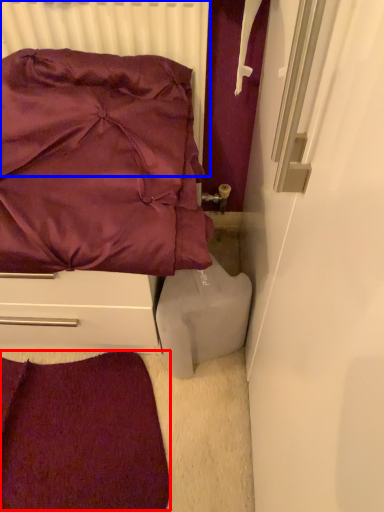
Question: Which point is further to the camera, violet (highlighted by a red box) or radiator (highlighted by a blue box)?

Choices:
 (A) violet
 (B) radiator

Answer: (A)